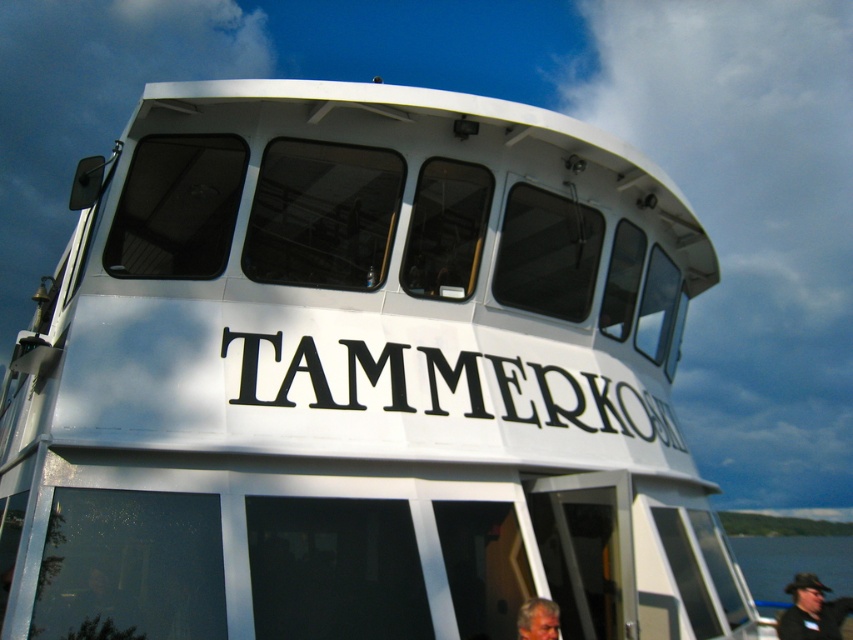
Is blue water at lower right above gray hair at lower center?

No, blue water at lower right is not above gray hair at lower center.

Is blue water at lower right further to the viewer compared to gray hair at lower center?

Yes, blue water at lower right is further from the viewer.

Identify the location of blue water at lower right. (793, 563).

Between blackmaterial/texturetammerkoski at center and blue water at lower right, which one is positioned higher?

blackmaterial/texturetammerkoski at center is above.

Who is positioned more to the left, blackmaterial/texturetammerkoski at center or blue water at lower right?

From the viewer's perspective, blackmaterial/texturetammerkoski at center appears more on the left side.

Where is `blackmaterial/texturetammerkoski at center`? This screenshot has width=853, height=640. blackmaterial/texturetammerkoski at center is located at coordinates (440, 385).

Looking at this image, does black fabric hat at lower right appear on the right side of gray hair at lower center?

Yes, black fabric hat at lower right is to the right of gray hair at lower center.

Looking at this image, who is taller, black fabric hat at lower right or gray hair at lower center?

black fabric hat at lower right

Is point (798, 630) positioned before point (556, 634)?

No.

Where is `black fabric hat at lower right`? This screenshot has width=853, height=640. black fabric hat at lower right is located at coordinates (811, 611).